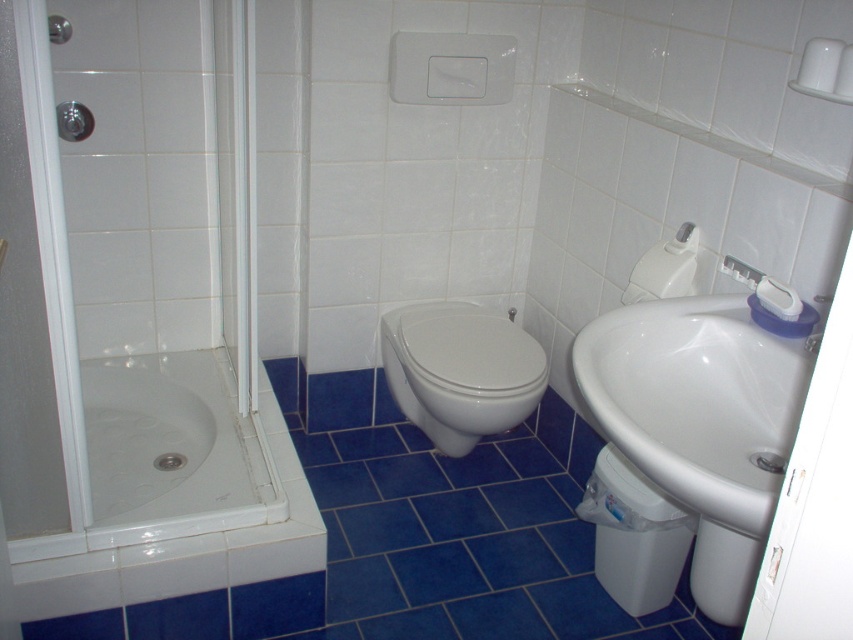
Is point (751, 284) less distant than point (55, 36)?

Yes, it is in front of point (55, 36).

Can you confirm if white glossy faucet at upper right is positioned above brushed metal shower at upper left?

Incorrect, white glossy faucet at upper right is not positioned above brushed metal shower at upper left.

Image resolution: width=853 pixels, height=640 pixels. I want to click on white glossy faucet at upper right, so click(x=741, y=272).

In the scene shown: Between white glossy bidet at lower right and white glossy faucet at upper right, which one appears on the right side from the viewer's perspective?

Positioned to the right is white glossy faucet at upper right.

Does point (746, 577) lie behind point (740, 269)?

No.

Is point (749, 563) positioned before point (738, 268)?

Yes, it is in front of point (738, 268).

Where is `white glossy bidet at lower right`? The width and height of the screenshot is (853, 640). white glossy bidet at lower right is located at coordinates (723, 572).

Can you confirm if white glossy shower tray at lower left is thinner than white glossy bidet at lower right?

Incorrect, white glossy shower tray at lower left's width is not less than white glossy bidet at lower right's.

The width and height of the screenshot is (853, 640). I want to click on white glossy shower tray at lower left, so click(172, 451).

Locate an element on the screen. This screenshot has width=853, height=640. white glossy shower tray at lower left is located at coordinates (172, 451).